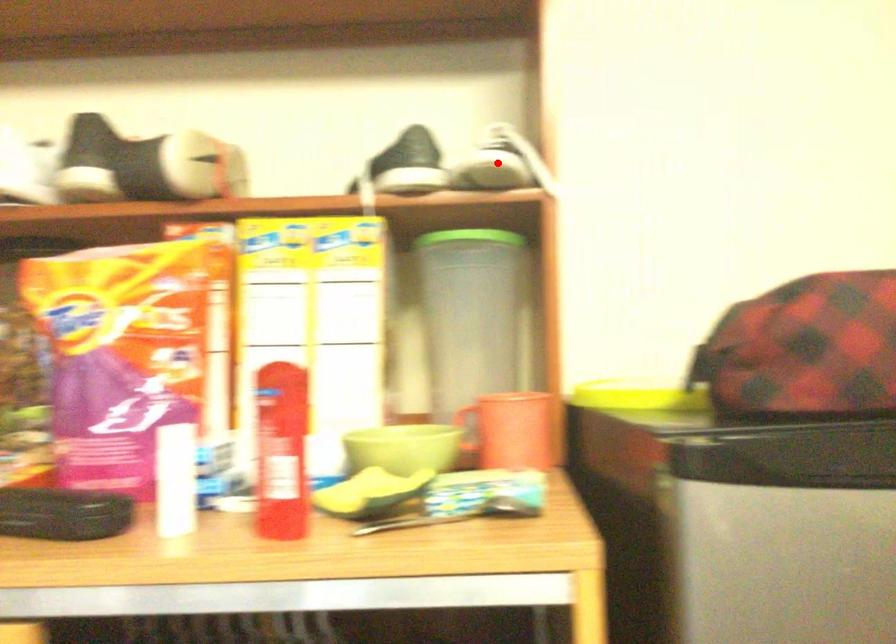
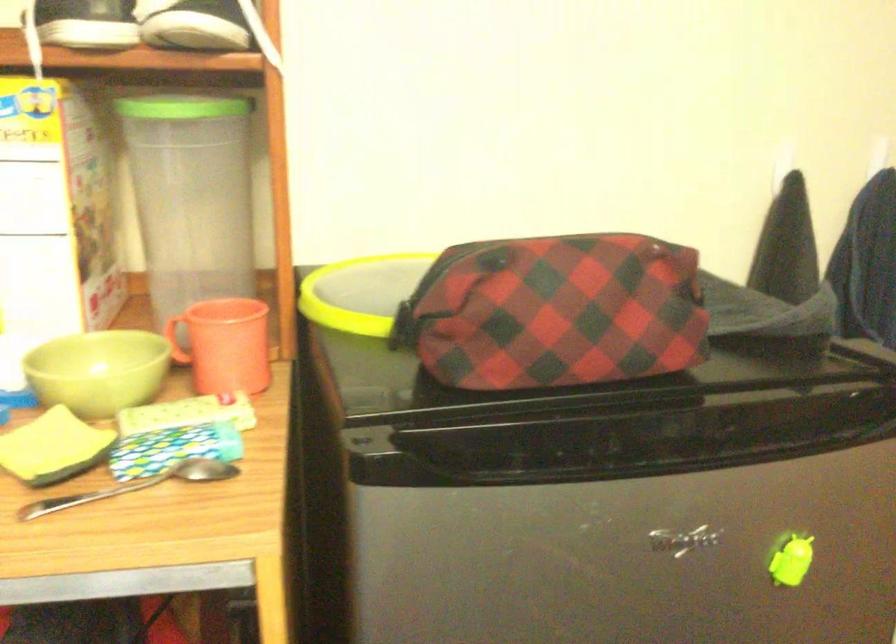
Question: A red point is marked in image1. In image2, is the corresponding 3D point closer to the camera or farther? Reply with the corresponding letter.

Choices:
 (A) The corresponding 3D point is closer.
 (B) The corresponding 3D point is farther.

Answer: (A)